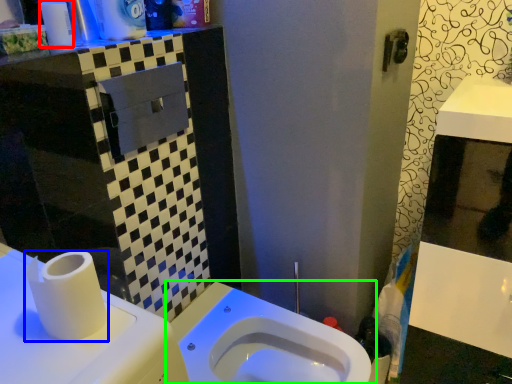
Question: Estimate the real-world distances between objects in this image. Which object is farther from toiletry (highlighted by a red box), toilet paper (highlighted by a blue box) or toilet (highlighted by a green box)?

Choices:
 (A) toilet paper
 (B) toilet

Answer: (B)